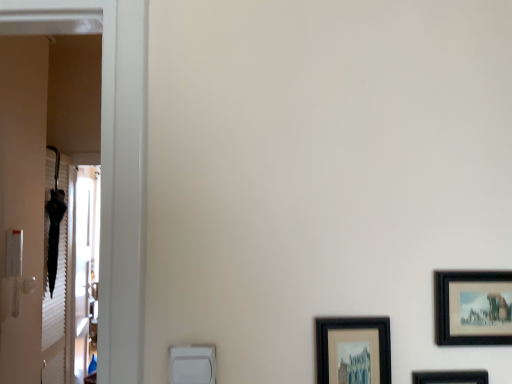
Question: Can you confirm if black matte picture frame at lower right, which is the 1th picture frame from left to right, is thinner than clear glass screen door at left?

Choices:
 (A) no
 (B) yes

Answer: (B)

Question: From a real-world perspective, is black matte picture frame at lower right, which is the 1th picture frame from left to right, under clear glass screen door at left?

Choices:
 (A) no
 (B) yes

Answer: (A)

Question: Can you confirm if black matte picture frame at lower right, the 3th picture frame viewed from the right, is taller than clear glass screen door at left?

Choices:
 (A) no
 (B) yes

Answer: (A)

Question: Can you confirm if black matte picture frame at lower right, the 3th picture frame viewed from the right, is wider than clear glass screen door at left?

Choices:
 (A) yes
 (B) no

Answer: (B)

Question: From the image's perspective, does black matte picture frame at lower right, which is the 1th picture frame from left to right, appear lower than clear glass screen door at left?

Choices:
 (A) yes
 (B) no

Answer: (B)

Question: Considering the positions of point (351, 350) and point (69, 372), is point (351, 350) closer or farther from the camera than point (69, 372)?

Choices:
 (A) closer
 (B) farther

Answer: (A)

Question: Considering the positions of black matte picture frame at lower right, the 3th picture frame viewed from the right, and clear glass screen door at left in the image, is black matte picture frame at lower right, the 3th picture frame viewed from the right, bigger or smaller than clear glass screen door at left?

Choices:
 (A) small
 (B) big

Answer: (A)

Question: Is black matte picture frame at lower right, which is the 1th picture frame from left to right, wider or thinner than clear glass screen door at left?

Choices:
 (A) wide
 (B) thin

Answer: (B)

Question: From a real-world perspective, is black matte picture frame at lower right, the 3th picture frame viewed from the right, physically located above or below clear glass screen door at left?

Choices:
 (A) above
 (B) below

Answer: (A)

Question: From the image's perspective, is black matte picture frame at right, arranged as the third picture frame when viewed from the left, located above or below black matte picture frame at lower right, the 3th picture frame viewed from the right?

Choices:
 (A) above
 (B) below

Answer: (A)

Question: Looking at their shapes, would you say black matte picture frame at right, arranged as the third picture frame when viewed from the left, is wider or thinner than black matte picture frame at lower right, which is the 1th picture frame from left to right?

Choices:
 (A) wide
 (B) thin

Answer: (B)

Question: Is black matte picture frame at right, arranged as the third picture frame when viewed from the left, to the left or to the right of black matte picture frame at lower right, the 3th picture frame viewed from the right, in the image?

Choices:
 (A) left
 (B) right

Answer: (B)

Question: Choose the correct answer: Is black matte picture frame at right, arranged as the third picture frame when viewed from the left, inside black matte picture frame at lower right, the 3th picture frame viewed from the right, or outside it?

Choices:
 (A) outside
 (B) inside

Answer: (A)

Question: From their relative heights in the image, would you say black matte picture frame at right, which is the 1th picture frame in right-to-left order, is taller or shorter than clear glass screen door at left?

Choices:
 (A) short
 (B) tall

Answer: (A)

Question: Considering the positions of black matte picture frame at right, arranged as the third picture frame when viewed from the left, and clear glass screen door at left in the image, is black matte picture frame at right, arranged as the third picture frame when viewed from the left, wider or thinner than clear glass screen door at left?

Choices:
 (A) thin
 (B) wide

Answer: (A)